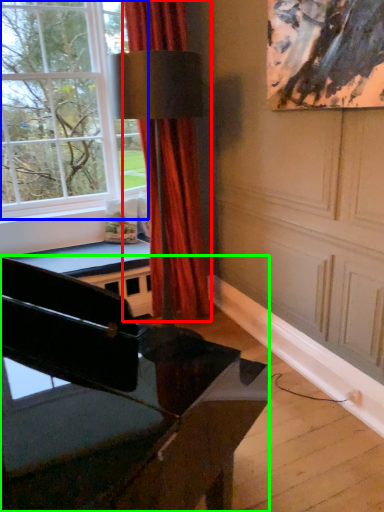
Question: Based on their relative distances, which object is farther from curtain (highlighted by a red box)? Choose from window (highlighted by a blue box) and piano (highlighted by a green box).

Choices:
 (A) window
 (B) piano

Answer: (B)